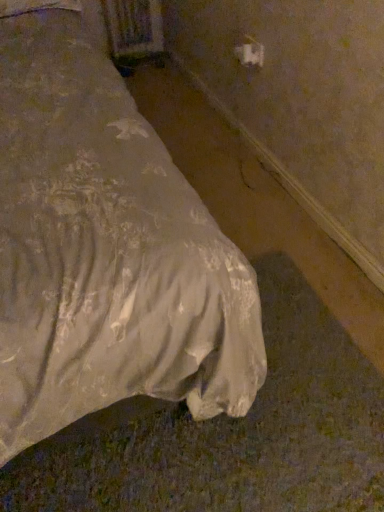
Question: Considering the positions of point (26, 340) and point (251, 41), is point (26, 340) closer or farther from the camera than point (251, 41)?

Choices:
 (A) farther
 (B) closer

Answer: (B)

Question: From a real-world perspective, is white fabric bed at lower left physically located above or below white plastic outlet at upper right?

Choices:
 (A) above
 (B) below

Answer: (A)

Question: Looking at their shapes, would you say white fabric bed at lower left is wider or thinner than white plastic outlet at upper right?

Choices:
 (A) wide
 (B) thin

Answer: (A)

Question: Based on their sizes in the image, would you say white plastic outlet at upper right is bigger or smaller than white fabric bed at lower left?

Choices:
 (A) big
 (B) small

Answer: (B)

Question: Relative to white fabric bed at lower left, is white plastic outlet at upper right in front or behind?

Choices:
 (A) front
 (B) behind

Answer: (B)

Question: Is white plastic outlet at upper right taller or shorter than white fabric bed at lower left?

Choices:
 (A) short
 (B) tall

Answer: (A)

Question: From the image's perspective, relative to white fabric bed at lower left, is white plastic outlet at upper right above or below?

Choices:
 (A) above
 (B) below

Answer: (A)